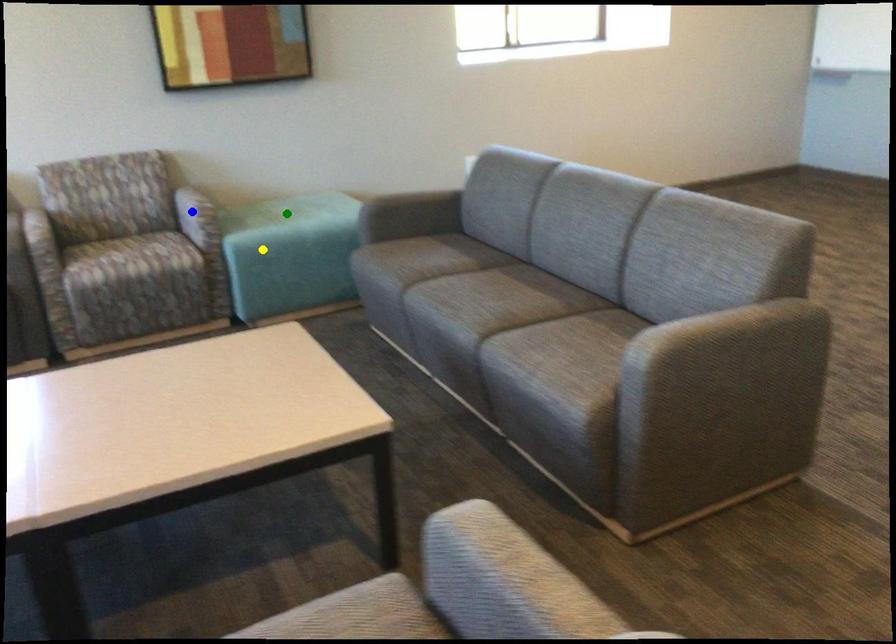
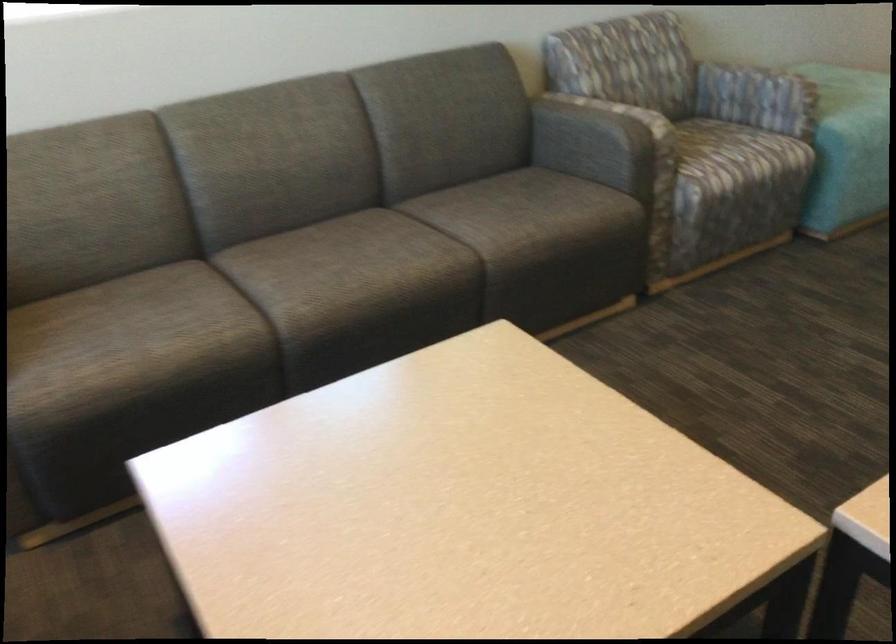
I am providing you with two images of the same scene from different viewpoints. Three points are marked in image1. Which point corresponds to a part or object that is occluded in image2?In image1, three points are marked. Which of them correspond to a part or object that is occluded in image2?Among the three points shown in image1, which one corresponds to a part or object that is no longer visible due to occlusion in image2?

green point cannot be seen in image2.